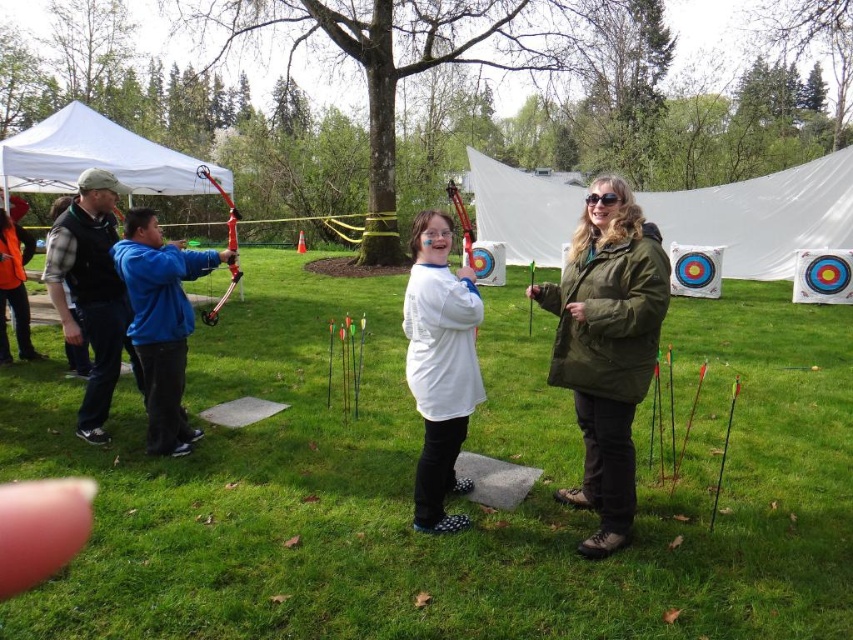
Which of these two, white matte shirt at center or matte black vest at left, stands taller?

matte black vest at left is taller.

Who is more distant from viewer, (421, 500) or (102, 204)?

Point (102, 204)

This screenshot has height=640, width=853. What are the coordinates of `white matte shirt at center` in the screenshot? It's located at (440, 365).

Measure the distance from white fabric tent at upper center to orange fleece jacket at left.

white fabric tent at upper center and orange fleece jacket at left are 10.79 meters apart.

Between point (839, 172) and point (4, 296), which one is positioned in front?

Point (4, 296) is in front.

Locate an element on the screen. white fabric tent at upper center is located at coordinates (762, 216).

Between white fabric tent at upper center and white matte shirt at center, which one is positioned higher?

white fabric tent at upper center is higher up.

Which is in front, point (822, 214) or point (436, 451)?

Positioned in front is point (436, 451).

Image resolution: width=853 pixels, height=640 pixels. I want to click on white fabric tent at upper center, so click(x=762, y=216).